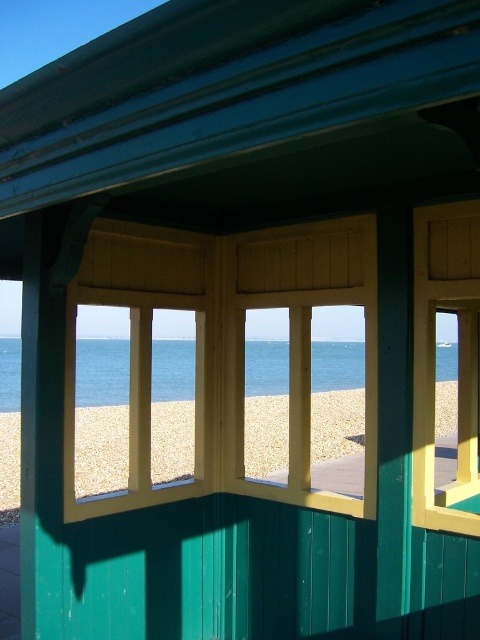
You are standing on the pebble beach in front of the green beach hut. You notice the smooth sand at lower center and the blue water at center. Which of these two areas is closer to the horizon line?

The blue water at center is closer to the horizon line because it is taller than the smooth sand at lower center, meaning it extends further towards the horizon.